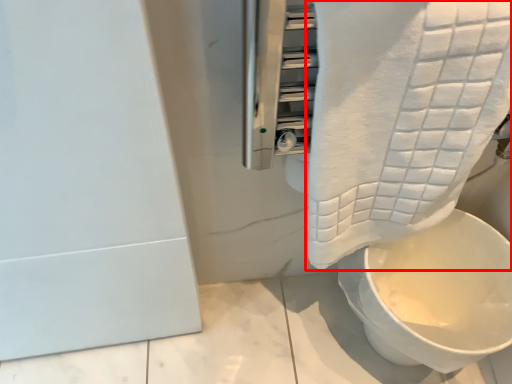
Question: From the image, what is the correct spatial relationship of towel (annotated by the red box) in relation to toilet?

Choices:
 (A) left
 (B) right

Answer: (A)